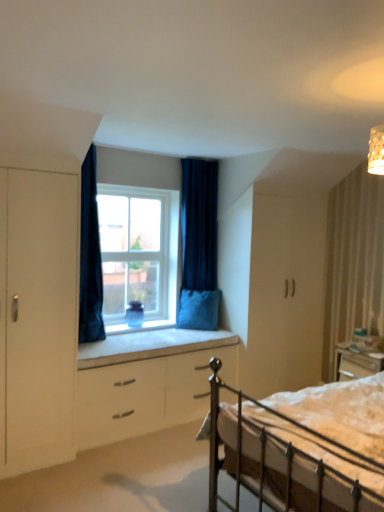
Question: Looking at the image, does velvet dark blue curtain at center, which is counted as the 2th curtain, starting from the front, seem bigger or smaller compared to velvet blue pillow at window?

Choices:
 (A) small
 (B) big

Answer: (B)

Question: Do you think velvet dark blue curtain at center, which is counted as the 2th curtain, starting from the front, is within velvet blue pillow at window, or outside of it?

Choices:
 (A) inside
 (B) outside

Answer: (B)

Question: Which object is positioned farthest from the clear glass window at center?

Choices:
 (A) velvet dark blue curtain at center, which is the first curtain from back to front
 (B) white matte cabinet at right
 (C) white cushioned window sill at center
 (D) white glossy chest of drawers at center
 (E) dark blue velvet curtain at upper center, positioned as the 2th curtain in right-to-left order

Answer: (B)

Question: Which object is the farthest from the metallic silver bed at lower right?

Choices:
 (A) white cushioned window sill at center
 (B) dark blue velvet curtain at upper center, which appears as the 2th curtain when viewed from the back
 (C) white matte cabinet at right
 (D) velvet blue pillow at window
 (E) white glossy chest of drawers at center

Answer: (D)